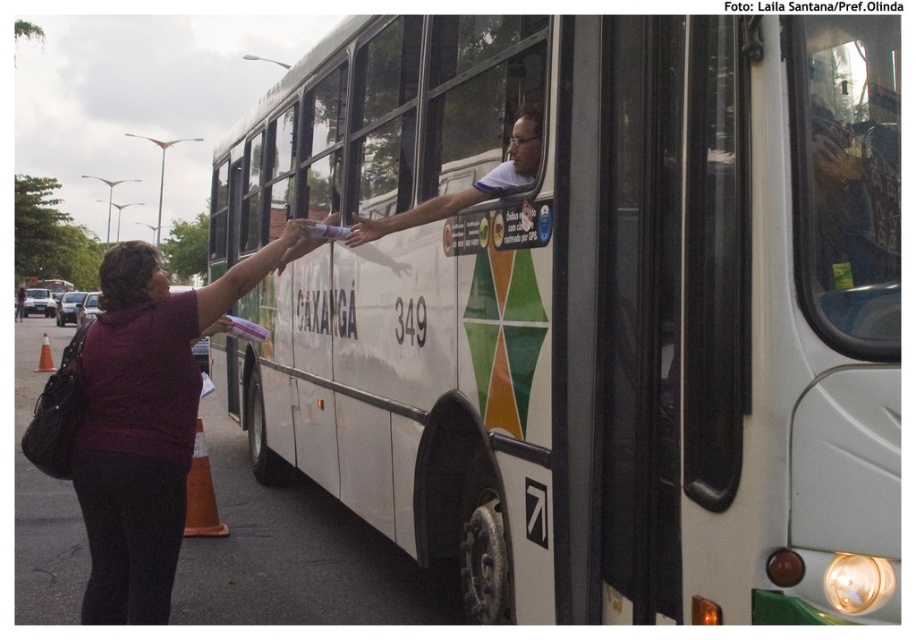
Can you confirm if purple matte shirt at left is smaller than white glossy shirt at center?

Incorrect, purple matte shirt at left is not smaller in size than white glossy shirt at center.

Which is above, purple matte shirt at left or white glossy shirt at center?

white glossy shirt at center

The width and height of the screenshot is (916, 640). Describe the element at coordinates (145, 422) in the screenshot. I see `purple matte shirt at left` at that location.

Locate an element on the screen. The height and width of the screenshot is (640, 916). purple matte shirt at left is located at coordinates (145, 422).

Can you confirm if white matte bus at center is smaller than purple matte shirt at left?

Indeed, white matte bus at center has a smaller size compared to purple matte shirt at left.

Who is more distant from viewer, (855, 365) or (113, 593)?

The point (113, 593) is behind.

Which is in front, point (402, 156) or point (132, 289)?

Point (132, 289) is more forward.

The height and width of the screenshot is (640, 916). I want to click on white matte bus at center, so click(587, 307).

Between white matte bus at center and white glossy shirt at center, which one appears on the right side from the viewer's perspective?

From the viewer's perspective, white glossy shirt at center appears more on the right side.

Who is more distant from viewer, (x=647, y=410) or (x=478, y=180)?

Positioned behind is point (x=478, y=180).

Image resolution: width=916 pixels, height=640 pixels. What are the coordinates of `white matte bus at center` in the screenshot? It's located at (587, 307).